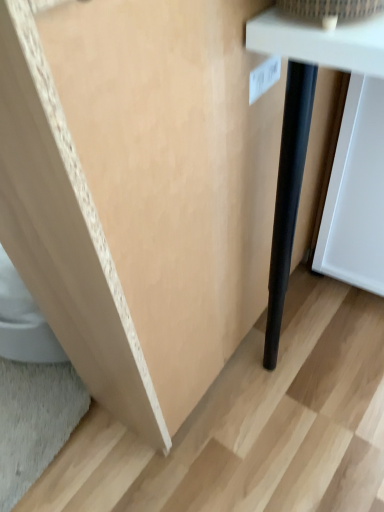
Question: Should I look upward or downward to see black matte pole at lower right?

Choices:
 (A) down
 (B) up

Answer: (B)